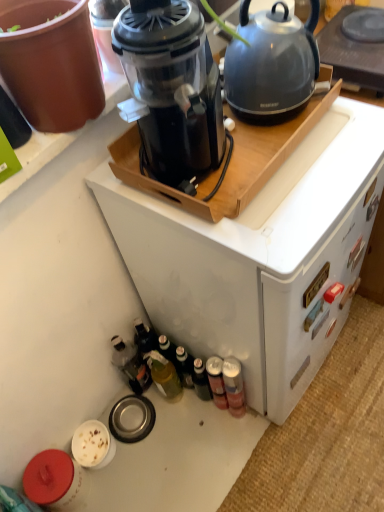
Question: Considering their positions, is translucent glass bottle at lower center, which is the 3th bottle from right to left, located in front of or behind metallic gray kettle at upper right?

Choices:
 (A) behind
 (B) front

Answer: (A)

Question: Does point (162, 375) appear closer or farther from the camera than point (276, 77)?

Choices:
 (A) farther
 (B) closer

Answer: (A)

Question: Which of these objects is positioned closest to the matte gray kettle at upper right?

Choices:
 (A) metallic gray kettle at upper right
 (B) metallic silver can at lower right, which is the 4th bottle from left to right
 (C) translucent plastic bottle at lower left, the 4th bottle when ordered from right to left
 (D) metallic silver can at lower right, marked as the 2th bottle in a right-to-left arrangement
 (E) black plastic blender at upper center

Answer: (A)

Question: Estimate the real-world distances between objects in this image. Which object is closer to the translucent plastic bottle at lower left, the 4th bottle when ordered from right to left?

Choices:
 (A) metallic gray kettle at upper right
 (B) black plastic blender at upper center
 (C) metallic silver can at lower right, which is the third bottle from left to right
 (D) matte gray kettle at upper right
 (E) metallic silver can at lower right, which is the 4th bottle from left to right

Answer: (C)